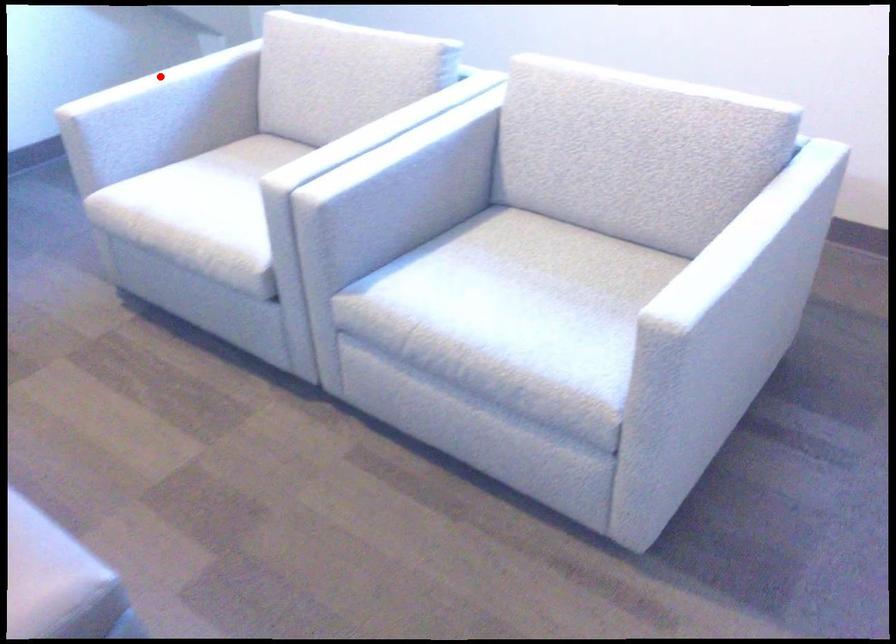
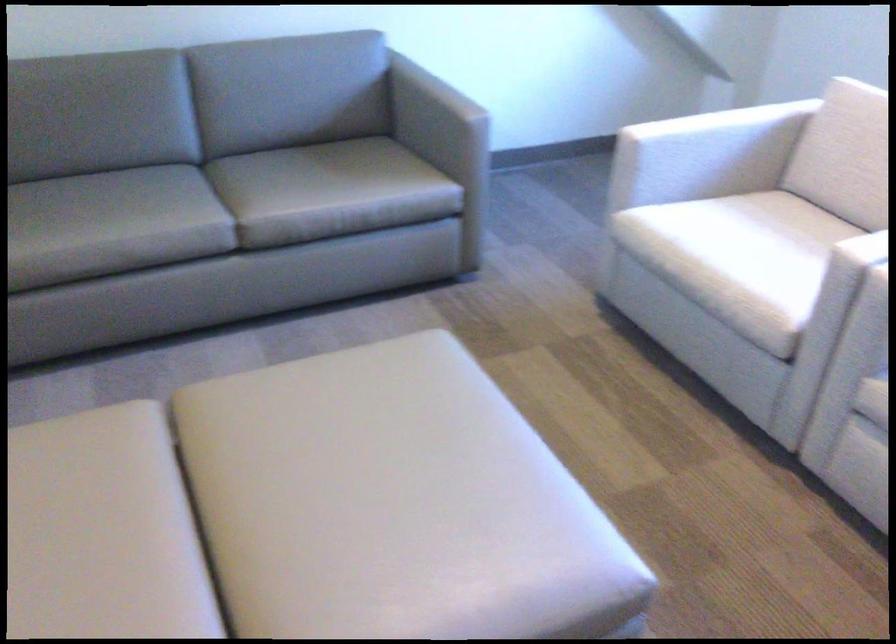
In the second image, find the point that corresponds to the highlighted location in the first image.

(719, 120)